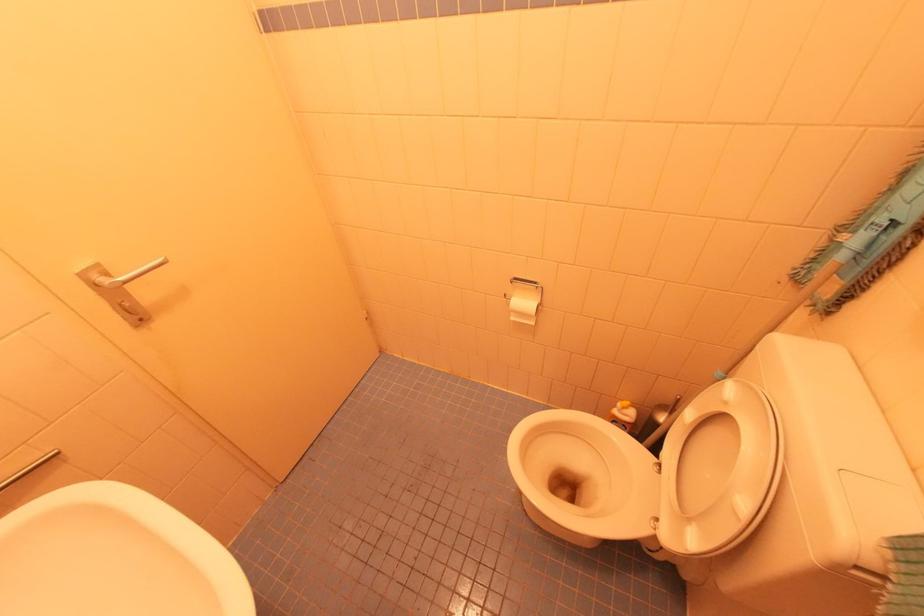
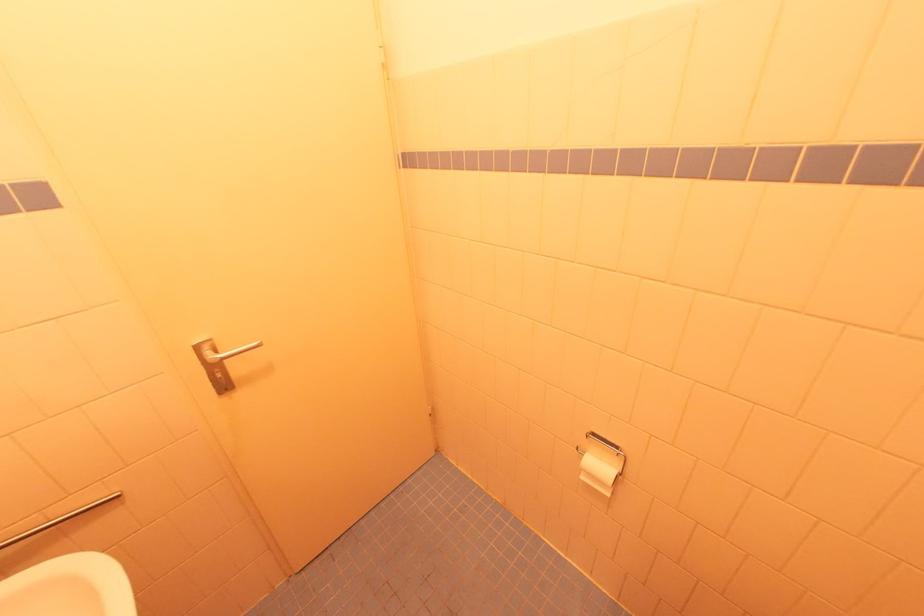
Locate, in the second image, the point that corresponds to point 514,318 in the first image.

(585, 479)